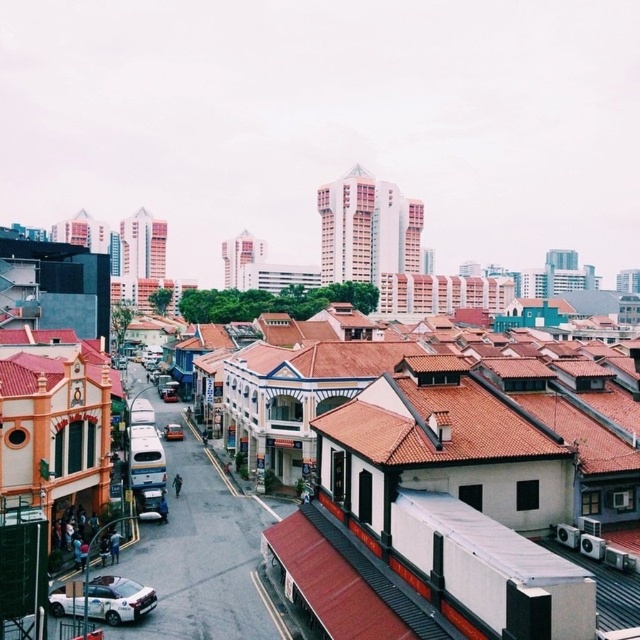
You are a delivery driver approaching the scene from the main road. You need to park your vehicle near the white glossy car at lower left and the metallic silver car at center. Based on their positions, which car should you park closer to if you want to be equidistant from both?

You should park closer to the metallic silver car at center because the white glossy car at lower left is positioned below it, meaning the metallic silver car is higher up and would allow for an equidistant parking spot between both vehicles.

You are standing at the center of the image looking out. There is a point marked at coordinates (x=118, y=600). What object is located at that point?

The point at coordinates (x=118, y=600) corresponds to the white glossy car at lower left.

You are a delivery driver who needs to park your truck in a space that can only accommodate vehicles shorter than 5 meters. You see a shiny red car at center and a metallic silver car at center in the parking lot. Which car is shorter and can fit into the space?

The shiny red car at center is shorter than the metallic silver car at center, so it can fit into the parking space designed for vehicles under 5 meters.